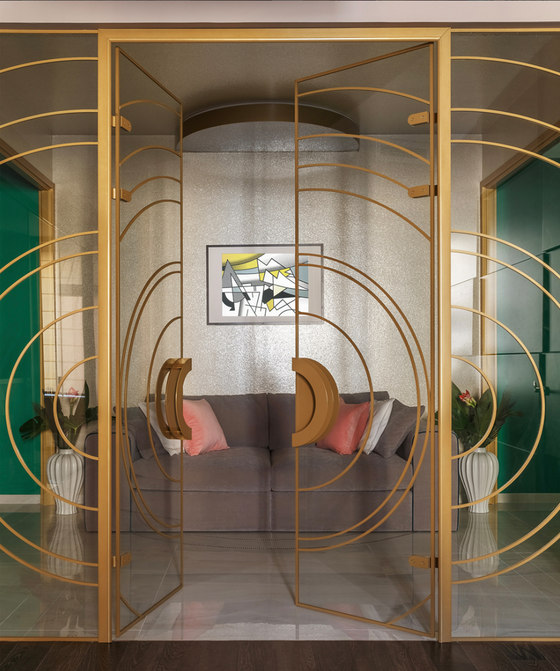
In order to click on artwork in this screenshot , I will do 261,300.